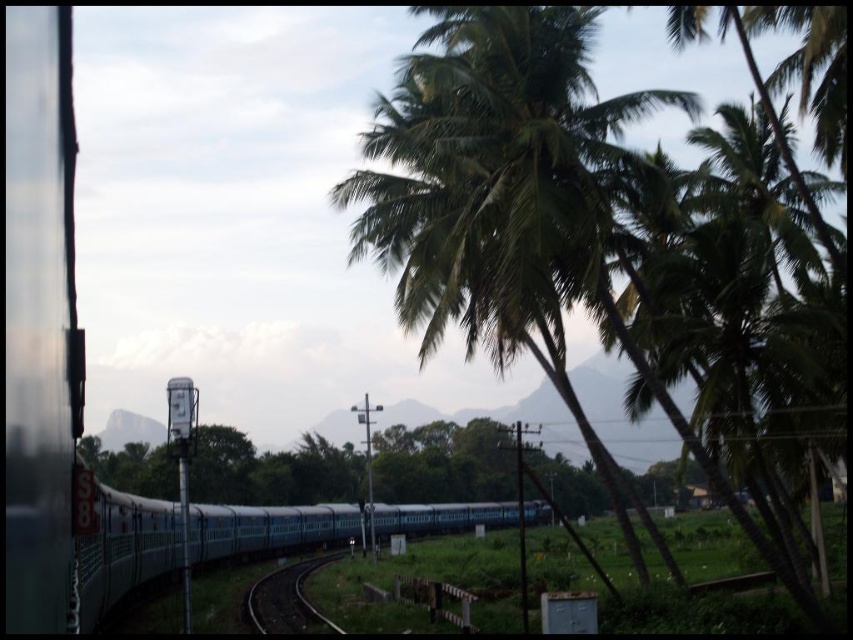
Looking at this image, can you confirm if green leafy coconut tree at center is positioned to the left of black metal track at center?

No, green leafy coconut tree at center is not to the left of black metal track at center.

Is green leafy coconut tree at center in front of black metal track at center?

Yes, it is.

Does point (466, 196) lie in front of point (260, 630)?

Yes, point (466, 196) is closer to viewer.

The image size is (853, 640). I want to click on green leafy coconut tree at center, so click(486, 145).